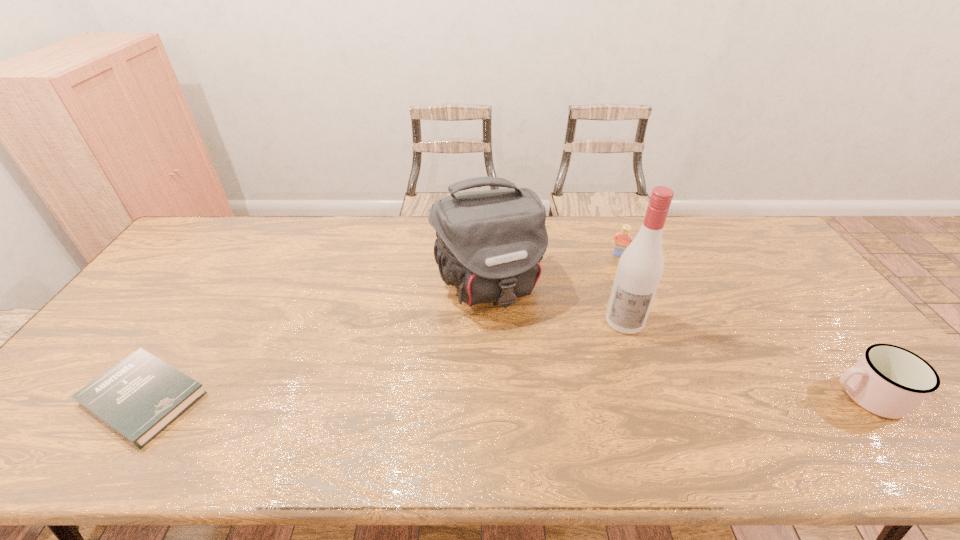
Locate an element on the screen. Image resolution: width=960 pixels, height=540 pixels. vacant space at the left edge of the desktop is located at coordinates (181, 260).

The image size is (960, 540). In order to click on vacant area at the right edge in this screenshot , I will do `click(836, 352)`.

At what (x,y) coordinates should I click in order to perform the action: click on free region at the far left corner of the desktop. Please return your answer as a coordinate pair (x, y). This screenshot has width=960, height=540. Looking at the image, I should click on (192, 233).

I want to click on unoccupied area between the rightmost object and the alcohol, so click(745, 358).

What are the coordinates of `empty space that is in between the alcohol and the mug` in the screenshot? It's located at (x=745, y=358).

Locate an element on the screen. vacant space that's between the shortest object and the rightmost object is located at coordinates (504, 397).

The image size is (960, 540). Identify the location of free space between the rightmost object and the fourth shortest object. (677, 341).

The image size is (960, 540). I want to click on free space between the leftmost object and the fourth shortest object, so click(316, 342).

At what (x,y) coordinates should I click in order to perform the action: click on free space between the fourth shortest object and the mug. Please return your answer as a coordinate pair (x, y). This screenshot has height=540, width=960. Looking at the image, I should click on (677, 341).

Locate which object ranks second in proximity to the rightmost object. Please provide its 2D coordinates. Your answer should be formatted as a tuple, i.e. [(x, y)], where the tuple contains the x and y coordinates of a point satisfying the conditions above.

[(624, 238)]